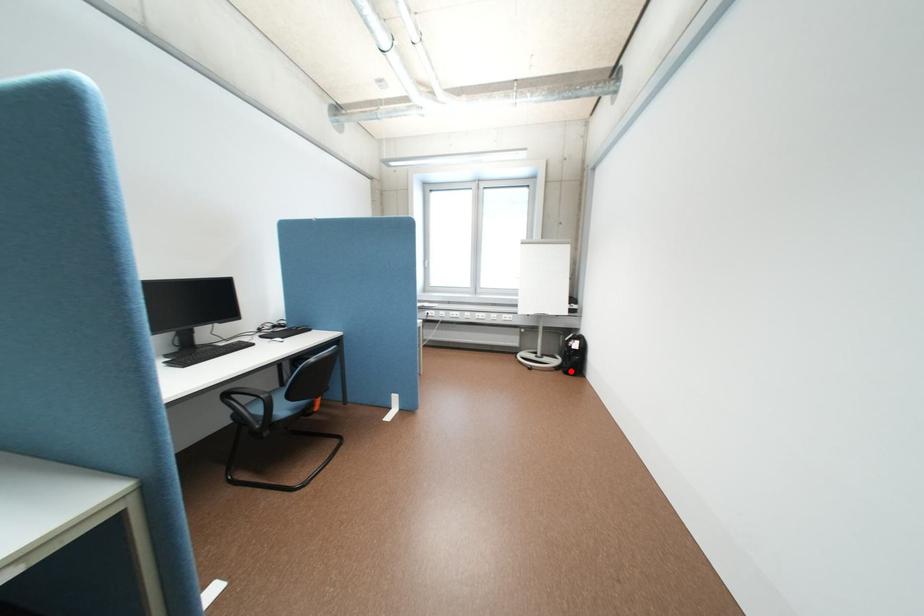
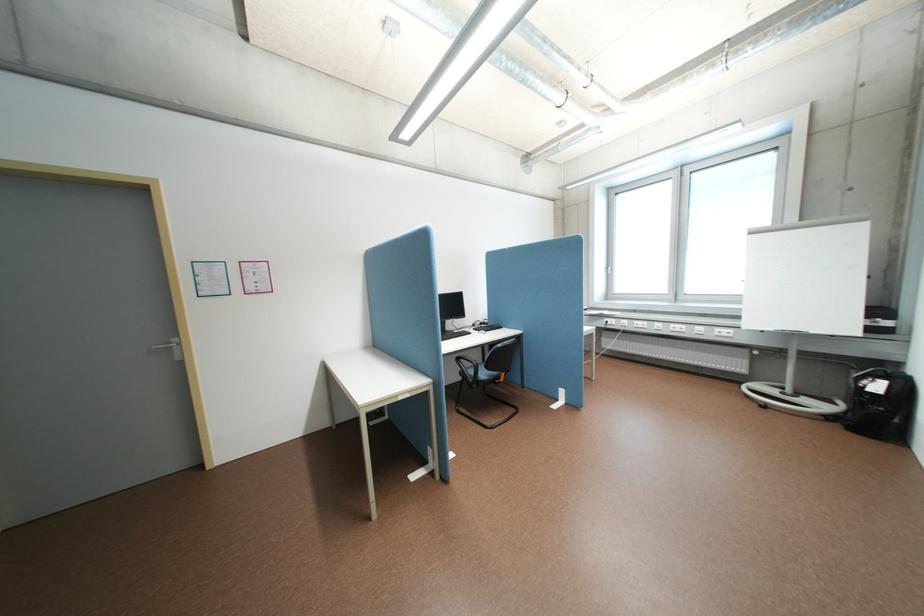
Question: I am providing you with two images of the same scene from different viewpoints. Image1 has a red point marked. In image2, the corresponding 3D location appears at what relative position? Reply with the corresponding letter.

Choices:
 (A) Closer
 (B) Farther

Answer: (A)